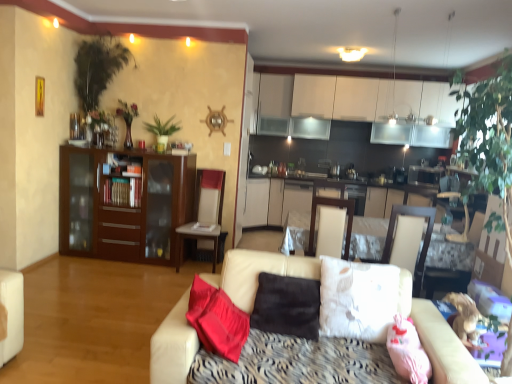
Where is `free space that is in between white leather chair at center and brown wood cabinet at left`? free space that is in between white leather chair at center and brown wood cabinet at left is located at coordinates (132, 266).